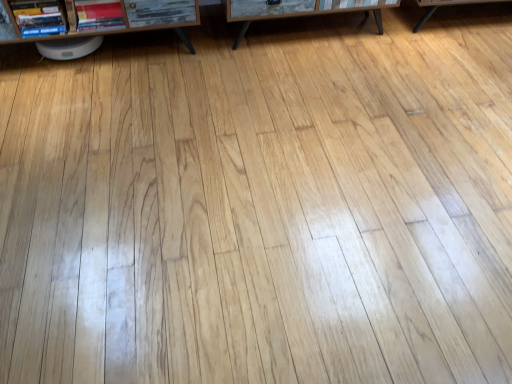
Question: From the image's perspective, is wooden table at center above or below matte red book at left, the first book positioned from the right?

Choices:
 (A) above
 (B) below

Answer: (A)

Question: From a real-world perspective, relative to matte red book at left, the first book positioned from the right, is wooden table at center vertically above or below?

Choices:
 (A) above
 (B) below

Answer: (B)

Question: Estimate the real-world distances between objects in this image. Which object is closer to the matte red book at left, the first book positioned from the right?

Choices:
 (A) hardcover book at upper left, arranged as the 2th book when viewed from the right
 (B) wooden table at center
 (C) brown wood shelf at upper left

Answer: (C)

Question: Considering the real-world distances, which object is closest to the hardcover book at upper left, arranged as the 2th book when viewed from the right?

Choices:
 (A) wooden table at center
 (B) brown wood shelf at upper left
 (C) matte red book at left, the 2th book in the left-to-right sequence

Answer: (B)